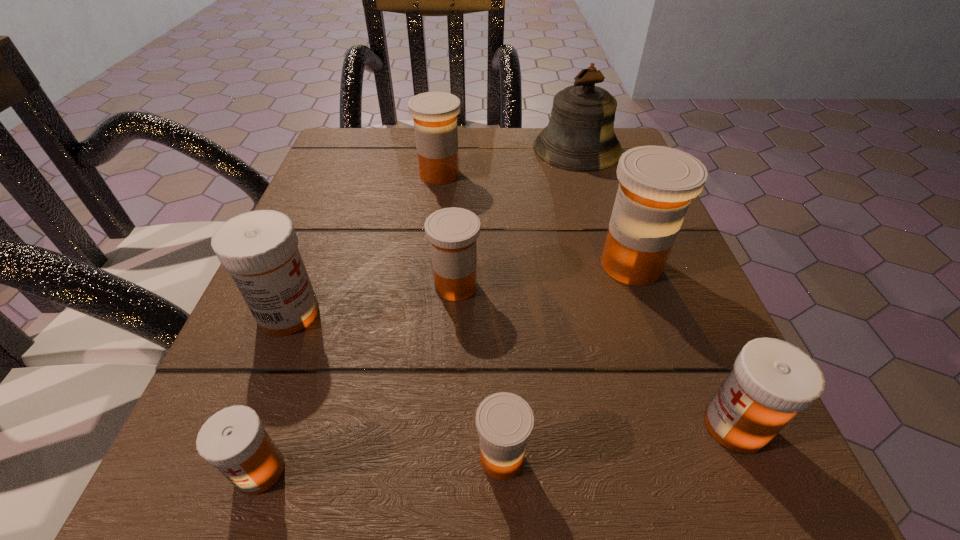
Where is `bell`? bell is located at coordinates (580, 136).

Find the location of `the tallest medicine`. the tallest medicine is located at coordinates (657, 183).

The image size is (960, 540). Identify the location of the rightmost orange medicine. (657, 183).

The height and width of the screenshot is (540, 960). Find the location of `the third smallest orange medicine`. the third smallest orange medicine is located at coordinates [435, 114].

Locate an element on the screen. This screenshot has height=540, width=960. the farthest medicine is located at coordinates (435, 114).

Find the location of a particular element. Image resolution: width=960 pixels, height=540 pixels. the biggest white medicine is located at coordinates (259, 248).

Find the location of a particular element. The image size is (960, 540). the second smallest orange medicine is located at coordinates (452, 232).

I want to click on the rightmost white medicine, so click(772, 380).

Identify the location of the nearest orange medicine. This screenshot has height=540, width=960. (504, 421).

In order to click on the smallest white medicine in this screenshot , I will do `click(234, 440)`.